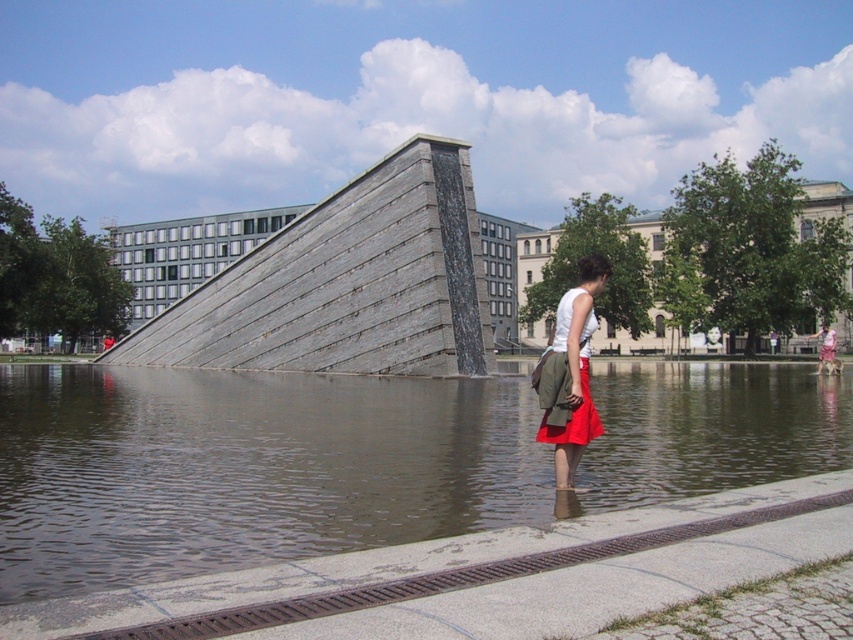
Where is `gray stone pyramid at center`? gray stone pyramid at center is located at coordinates (347, 284).

Does gray stone pyramid at center have a larger size compared to matte khaki shorts at center?

No.

Is point (236, 342) less distant than point (555, 403)?

No, (236, 342) is further to viewer.

Locate an element on the screen. gray stone pyramid at center is located at coordinates (347, 284).

Looking at this image, how much distance is there between brown water at center and gray stone pyramid at center?

brown water at center is 9.77 meters from gray stone pyramid at center.

Which is behind, point (152, 406) or point (422, 170)?

Positioned behind is point (422, 170).

This screenshot has height=640, width=853. In order to click on brown water at center in this screenshot , I will do `click(358, 460)`.

What do you see at coordinates (358, 460) in the screenshot? The height and width of the screenshot is (640, 853). I see `brown water at center` at bounding box center [358, 460].

Is point (16, 509) closer to viewer compared to point (607, 276)?

Yes, it is in front of point (607, 276).

Describe the element at coordinates (358, 460) in the screenshot. I see `brown water at center` at that location.

I want to click on brown water at center, so click(358, 460).